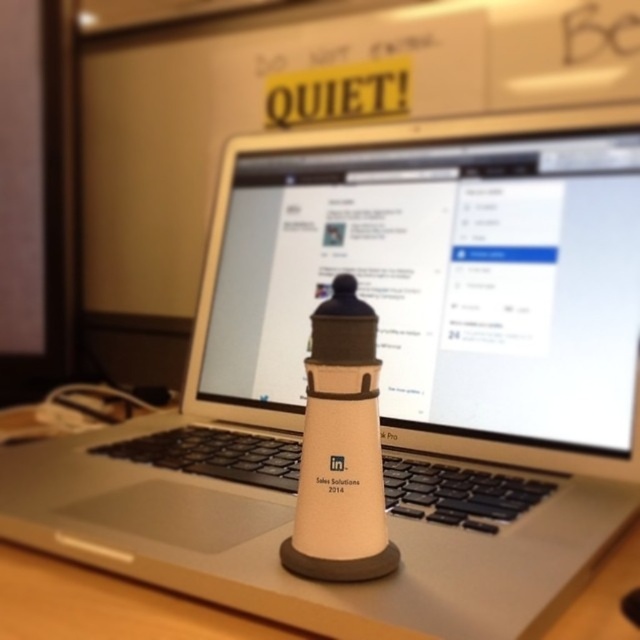
You are organizing a presentation and need to decide which object to use as a backdrop. Given the white matte computer screen at center and the white matte table at center, which one would you choose if you want the backdrop to be bigger?

The white matte computer screen at center is larger in size than the white matte table at center, so you should choose the white matte computer screen at center as the backdrop for a bigger size.

You are organizing a desk and need to place a new keyboard. The white matte computer screen at center and the white matte table at center are both in your view. Which object is positioned to the right side of the other?

The white matte computer screen at center is to the right of the white matte table at center.

You are a graphic designer working on a project and need to place a new icon on your desk. The icon must be placed exactly at the point with coordinates point (436, 280). Where should you place the icon relative to the white matte computer screen at center?

The point (436, 280) corresponds to the white matte computer screen at center, so you should place the icon directly on the white matte computer screen at center.